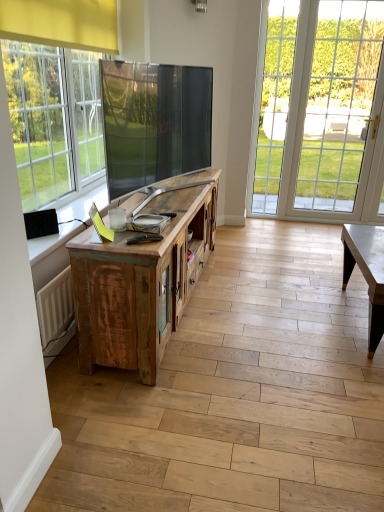
Question: From a real-world perspective, relative to weathered wood cabinet at center, is clear glass door at right vertically above or below?

Choices:
 (A) below
 (B) above

Answer: (B)

Question: Considering the positions of clear glass door at right and weathered wood cabinet at center in the image, is clear glass door at right bigger or smaller than weathered wood cabinet at center?

Choices:
 (A) small
 (B) big

Answer: (A)

Question: Is point (x=259, y=56) positioned closer to the camera than point (x=201, y=183)?

Choices:
 (A) farther
 (B) closer

Answer: (A)

Question: Is point (203, 218) positioned closer to the camera than point (281, 117)?

Choices:
 (A) closer
 (B) farther

Answer: (A)

Question: Is weathered wood cabinet at center bigger or smaller than clear glass door at right?

Choices:
 (A) big
 (B) small

Answer: (A)

Question: Considering their positions, is weathered wood cabinet at center located in front of or behind clear glass door at right?

Choices:
 (A) behind
 (B) front

Answer: (B)

Question: Would you say weathered wood cabinet at center is inside or outside clear glass door at right?

Choices:
 (A) outside
 (B) inside

Answer: (A)